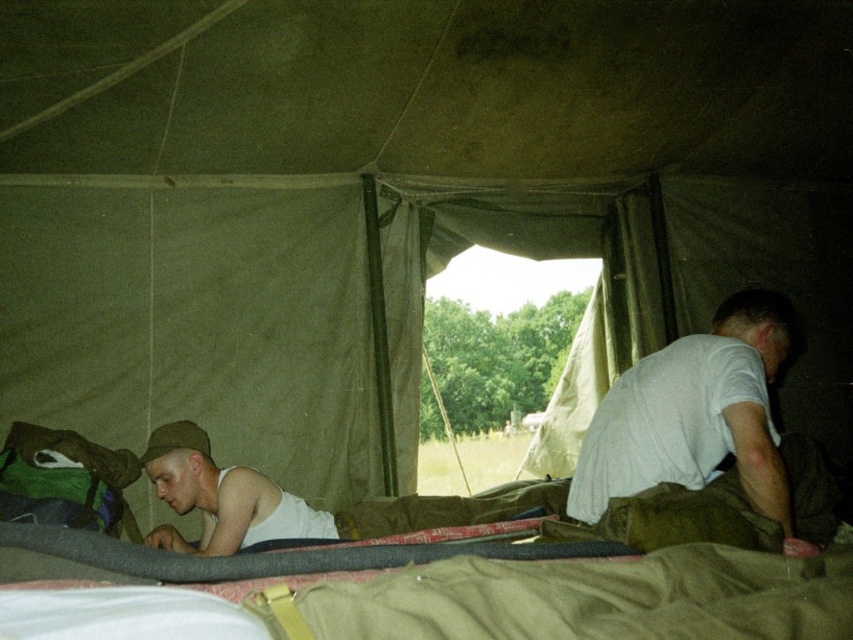
Which is more to the left, white cotton shirt at right or white matte tank top at lower left?

white matte tank top at lower left

Measure the distance between white cotton shirt at right and camera.

white cotton shirt at right and camera are 5.12 feet apart.

Locate an element on the screen. The height and width of the screenshot is (640, 853). white cotton shirt at right is located at coordinates (706, 436).

Who is positioned more to the left, khaki fabric at lower center or white cotton shirt at right?

Positioned to the left is khaki fabric at lower center.

Which is behind, point (556, 577) or point (640, 388)?

Positioned behind is point (640, 388).

Find the location of a particular element. khaki fabric at lower center is located at coordinates coord(595,598).

Between khaki fabric at lower center and white matte tank top at lower left, which one appears on the right side from the viewer's perspective?

khaki fabric at lower center is more to the right.

Is point (570, 593) less distant than point (193, 472)?

Yes, point (570, 593) is in front of point (193, 472).

The width and height of the screenshot is (853, 640). Find the location of `khaki fabric at lower center`. khaki fabric at lower center is located at coordinates (595, 598).